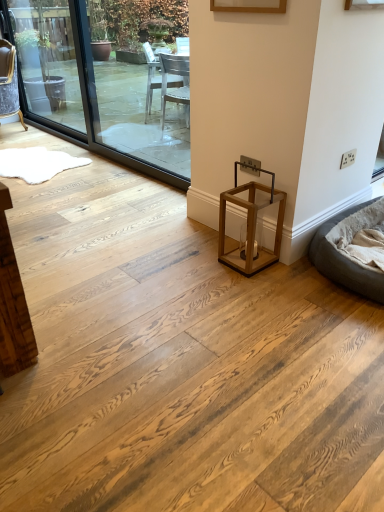
In order to face transparent glass window at left, which appears as the 1th window screen when viewed from the right, should I rotate leftwards or rightwards?

It's best to rotate left around 9.103 degrees.

Image resolution: width=384 pixels, height=512 pixels. Describe the element at coordinates (47, 63) in the screenshot. I see `transparent glass window at upper left, the first window screen positioned from the left` at that location.

Find the location of a particular element. This screenshot has width=384, height=512. velvet grey chair at left is located at coordinates (9, 82).

Where is `the 2nd window screen to the left when counting from the gray fabric bean bag at lower right`? the 2nd window screen to the left when counting from the gray fabric bean bag at lower right is located at coordinates (47, 63).

From a real-world perspective, is gray fabric bean bag at lower right physically located above or below transparent glass window at upper left, arranged as the second window screen when viewed from the right?

From a real-world perspective, gray fabric bean bag at lower right is physically below transparent glass window at upper left, arranged as the second window screen when viewed from the right.

Is gray fabric bean bag at lower right looking in the opposite direction of transparent glass window at upper left, the first window screen positioned from the left?

That's not correct — gray fabric bean bag at lower right is not looking away from transparent glass window at upper left, the first window screen positioned from the left.

Does gray fabric bean bag at lower right come in front of transparent glass window at upper left, arranged as the second window screen when viewed from the right?

Yes, the depth of gray fabric bean bag at lower right is less than that of transparent glass window at upper left, arranged as the second window screen when viewed from the right.

How many degrees apart are the facing directions of gray fabric bean bag at lower right and transparent glass window at left, which ranks as the second window screen in left-to-right order?

The angle between the facing direction of gray fabric bean bag at lower right and the facing direction of transparent glass window at left, which ranks as the second window screen in left-to-right order, is 3 degrees.

Is gray fabric bean bag at lower right positioned with its back to transparent glass window at left, which appears as the 1th window screen when viewed from the right?

No, gray fabric bean bag at lower right is not facing the opposite direction of transparent glass window at left, which appears as the 1th window screen when viewed from the right.

Can you confirm if gray fabric bean bag at lower right is shorter than transparent glass window at left, which appears as the 1th window screen when viewed from the right?

Indeed, gray fabric bean bag at lower right has a lesser height compared to transparent glass window at left, which appears as the 1th window screen when viewed from the right.

Is the depth of gray fabric bean bag at lower right less than that of transparent glass window at left, which ranks as the second window screen in left-to-right order?

Yes, it is.

From the image's perspective, relative to velvet grey chair at left, is transparent glass window at left, which appears as the 1th window screen when viewed from the right, above or below?

transparent glass window at left, which appears as the 1th window screen when viewed from the right, is below velvet grey chair at left.

Is transparent glass window at left, which appears as the 1th window screen when viewed from the right, further to the viewer compared to velvet grey chair at left?

No, it is in front of velvet grey chair at left.

How different are the orientations of transparent glass window at left, which ranks as the second window screen in left-to-right order, and velvet grey chair at left in degrees?

20.6 degrees.

Can you confirm if transparent glass window at left, which appears as the 1th window screen when viewed from the right, is positioned to the right of velvet grey chair at left?

Correct, you'll find transparent glass window at left, which appears as the 1th window screen when viewed from the right, to the right of velvet grey chair at left.

Based on their positions, is velvet grey chair at left located to the left or right of gray fabric bean bag at lower right?

velvet grey chair at left is positioned on gray fabric bean bag at lower right's left side.

From a real-world perspective, is velvet grey chair at left physically located above or below gray fabric bean bag at lower right?

In terms of real-world spatial position, velvet grey chair at left is above gray fabric bean bag at lower right.

Is velvet grey chair at left in contact with gray fabric bean bag at lower right?

No, velvet grey chair at left is not touching gray fabric bean bag at lower right.

Is velvet grey chair at left looking in the opposite direction of gray fabric bean bag at lower right?

velvet grey chair at left is not turned away from gray fabric bean bag at lower right.

From the image's perspective, is transparent glass window at upper left, the first window screen positioned from the left, on top of transparent glass window at left, which appears as the 1th window screen when viewed from the right?

Indeed, from the image's perspective, transparent glass window at upper left, the first window screen positioned from the left, is shown above transparent glass window at left, which appears as the 1th window screen when viewed from the right.

Between transparent glass window at upper left, the first window screen positioned from the left, and transparent glass window at left, which appears as the 1th window screen when viewed from the right, which one is positioned behind?

transparent glass window at upper left, the first window screen positioned from the left, is more distant.

The height and width of the screenshot is (512, 384). Find the location of `window screen that is on the right side of transparent glass window at upper left, the first window screen positioned from the left`. window screen that is on the right side of transparent glass window at upper left, the first window screen positioned from the left is located at coordinates (133, 83).

Can we say transparent glass window at upper left, arranged as the second window screen when viewed from the right, lies outside transparent glass window at left, which ranks as the second window screen in left-to-right order?

Yes.

Is transparent glass window at upper left, arranged as the second window screen when viewed from the right, aimed at velvet grey chair at left?

Yes, transparent glass window at upper left, arranged as the second window screen when viewed from the right, is facing velvet grey chair at left.

From a real-world perspective, who is located higher, transparent glass window at upper left, the first window screen positioned from the left, or velvet grey chair at left?

transparent glass window at upper left, the first window screen positioned from the left.

Locate an element on the screen. chair that is under the transparent glass window at upper left, arranged as the second window screen when viewed from the right (from a real-world perspective) is located at coordinates (9, 82).

Does transparent glass window at upper left, arranged as the second window screen when viewed from the right, have a greater height compared to velvet grey chair at left?

Correct, transparent glass window at upper left, arranged as the second window screen when viewed from the right, is much taller as velvet grey chair at left.

Is velvet grey chair at left oriented away from transparent glass window at upper left, arranged as the second window screen when viewed from the right?

Yes, velvet grey chair at left is facing away from transparent glass window at upper left, arranged as the second window screen when viewed from the right.

How different are the orientations of velvet grey chair at left and transparent glass window at upper left, arranged as the second window screen when viewed from the right, in degrees?

They differ by 20.1 degrees in their facing directions.

From the picture: Is velvet grey chair at left far from transparent glass window at upper left, the first window screen positioned from the left?

No, velvet grey chair at left is in close proximity to transparent glass window at upper left, the first window screen positioned from the left.

Is velvet grey chair at left to the left or to the right of transparent glass window at upper left, the first window screen positioned from the left, in the image?

From the image, it's evident that velvet grey chair at left is to the left of transparent glass window at upper left, the first window screen positioned from the left.

From the gray fabric bean bag at lower right, count the 2nd window screen to the left and point to it. Please provide its 2D coordinates.

[(47, 63)]

Locate an element on the screen. bean bag chair in front of the transparent glass window at left, which appears as the 1th window screen when viewed from the right is located at coordinates pos(344,262).

From the picture: Which object lies further to the anchor point transparent glass window at upper left, arranged as the second window screen when viewed from the right, gray fabric bean bag at lower right or transparent glass window at left, which ranks as the second window screen in left-to-right order?

gray fabric bean bag at lower right is further to transparent glass window at upper left, arranged as the second window screen when viewed from the right.

Estimate the real-world distances between objects in this image. Which object is further from transparent glass window at left, which appears as the 1th window screen when viewed from the right, transparent glass window at upper left, the first window screen positioned from the left, or velvet grey chair at left?

Among the two, velvet grey chair at left is located further to transparent glass window at left, which appears as the 1th window screen when viewed from the right.

From the image, which object appears to be farther from transparent glass window at left, which appears as the 1th window screen when viewed from the right, velvet grey chair at left or gray fabric bean bag at lower right?

The object further to transparent glass window at left, which appears as the 1th window screen when viewed from the right, is gray fabric bean bag at lower right.

Based on the photo, considering their positions, is gray fabric bean bag at lower right positioned closer to transparent glass window at left, which appears as the 1th window screen when viewed from the right, than transparent glass window at upper left, arranged as the second window screen when viewed from the right?

transparent glass window at upper left, arranged as the second window screen when viewed from the right, lies closer to transparent glass window at left, which appears as the 1th window screen when viewed from the right, than the other object.

From the image, which object appears to be farther from transparent glass window at left, which appears as the 1th window screen when viewed from the right, velvet grey chair at left or transparent glass window at upper left, the first window screen positioned from the left?

The object further to transparent glass window at left, which appears as the 1th window screen when viewed from the right, is velvet grey chair at left.

Based on their spatial positions, is velvet grey chair at left or transparent glass window at upper left, arranged as the second window screen when viewed from the right, further from gray fabric bean bag at lower right?

Based on the image, velvet grey chair at left appears to be further to gray fabric bean bag at lower right.

Based on the photo, which object lies nearer to the anchor point gray fabric bean bag at lower right, transparent glass window at left, which ranks as the second window screen in left-to-right order, or transparent glass window at upper left, the first window screen positioned from the left?

transparent glass window at left, which ranks as the second window screen in left-to-right order, lies closer to gray fabric bean bag at lower right than the other object.

When comparing their distances from transparent glass window at left, which ranks as the second window screen in left-to-right order, does gray fabric bean bag at lower right or velvet grey chair at left seem closer?

Among the two, velvet grey chair at left is located nearer to transparent glass window at left, which ranks as the second window screen in left-to-right order.

This screenshot has width=384, height=512. What are the coordinates of `window screen between velvet grey chair at left and transparent glass window at left, which appears as the 1th window screen when viewed from the right, in the horizontal direction` in the screenshot? It's located at (47, 63).

I want to click on window screen located between transparent glass window at upper left, the first window screen positioned from the left, and gray fabric bean bag at lower right in the left-right direction, so click(133, 83).